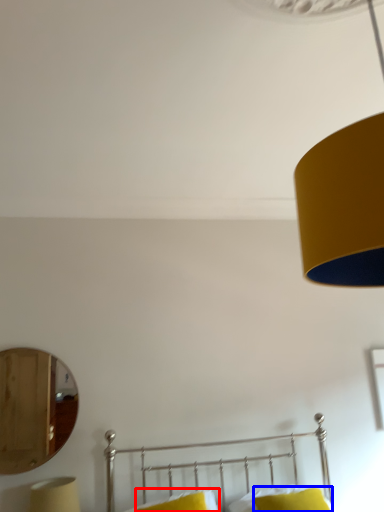
Question: Which object appears farthest to the camera in this image, pillow (highlighted by a red box) or pillow (highlighted by a blue box)?

Choices:
 (A) pillow
 (B) pillow

Answer: (A)